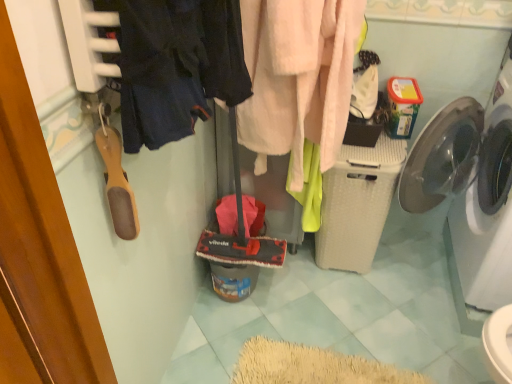
Describe the element at coordinates (357, 204) in the screenshot. The image size is (512, 384). I see `white textured laundry basket at center-right, which ranks as the second washing machine in right-to-left order` at that location.

Find the location of a particular element. Image resolution: width=512 pixels, height=384 pixels. wooden shoe at left is located at coordinates (117, 184).

Find the location of a particular element. This screenshot has height=384, width=512. white textured laundry basket at center-right, which ranks as the second washing machine in right-to-left order is located at coordinates (357, 204).

From a real-world perspective, which object rests below the other?

From a 3D spatial view, white textured laundry basket at center-right, which ranks as the second washing machine in right-to-left order, is below.

How far apart are wooden shoe at left and white textured laundry basket at center-right, which ranks as the second washing machine in right-to-left order?

The distance of wooden shoe at left from white textured laundry basket at center-right, which ranks as the second washing machine in right-to-left order, is 1.00 meters.

Is wooden shoe at left to the left of white textured laundry basket at center-right, which ranks as the second washing machine in right-to-left order, from the viewer's perspective?

Correct, you'll find wooden shoe at left to the left of white textured laundry basket at center-right, which ranks as the second washing machine in right-to-left order.

Which of these two, wooden shoe at left or white textured laundry basket at center-right, the first washing machine in the left-to-right sequence, is bigger?

white textured laundry basket at center-right, the first washing machine in the left-to-right sequence.

Based on the photo, in terms of width, does wooden shoe at left look wider or thinner when compared to white plastic washing machine at right, positioned as the 2th washing machine in left-to-right order?

wooden shoe at left is thinner than white plastic washing machine at right, positioned as the 2th washing machine in left-to-right order.

Does wooden shoe at left have a lesser height compared to white plastic washing machine at right, the first washing machine when ordered from right to left?

Yes.

From a real-world perspective, is wooden shoe at left physically located above or below white plastic washing machine at right, the first washing machine when ordered from right to left?

Clearly, from a real-world perspective, wooden shoe at left is above white plastic washing machine at right, the first washing machine when ordered from right to left.

Which object is positioned more to the left, wooden shoe at left or white plastic washing machine at right, the first washing machine when ordered from right to left?

Positioned to the left is wooden shoe at left.

How many degrees apart are the facing directions of white plastic washing machine at right, the first washing machine when ordered from right to left, and fuzzy pink towel at center, positioned as the first clothing in back-to-front order?

The angular difference between white plastic washing machine at right, the first washing machine when ordered from right to left, and fuzzy pink towel at center, positioned as the first clothing in back-to-front order, is 87.3 degrees.

Relative to fuzzy pink towel at center, placed as the second clothing when sorted from left to right, is white plastic washing machine at right, positioned as the 2th washing machine in left-to-right order, in front or behind?

In the image, white plastic washing machine at right, positioned as the 2th washing machine in left-to-right order, appears behind fuzzy pink towel at center, placed as the second clothing when sorted from left to right.

Is white plastic washing machine at right, the first washing machine when ordered from right to left, bigger or smaller than fuzzy pink towel at center, placed as the second clothing when sorted from left to right?

white plastic washing machine at right, the first washing machine when ordered from right to left, is bigger than fuzzy pink towel at center, placed as the second clothing when sorted from left to right.

The width and height of the screenshot is (512, 384). I want to click on washing machine that is the 1st object directly below the fuzzy pink towel at center, placed as the second clothing when sorted from left to right (from a real-world perspective), so (x=466, y=194).

Is wooden shoe at left turned away from fuzzy pink towel at center, positioned as the first clothing in back-to-front order?

wooden shoe at left is not turned away from fuzzy pink towel at center, positioned as the first clothing in back-to-front order.

Considering the sizes of objects wooden shoe at left and fuzzy pink towel at center, placed as the second clothing when sorted from left to right, in the image provided, who is taller, wooden shoe at left or fuzzy pink towel at center, placed as the second clothing when sorted from left to right,?

fuzzy pink towel at center, placed as the second clothing when sorted from left to right, is taller.

From the picture: Which object is more forward, wooden shoe at left or fuzzy pink towel at center, positioned as the first clothing in back-to-front order?

wooden shoe at left is more forward.

Where is `shoe that is above the fuzzy pink towel at center, placed as the second clothing when sorted from left to right (from a real-world perspective)`? Image resolution: width=512 pixels, height=384 pixels. shoe that is above the fuzzy pink towel at center, placed as the second clothing when sorted from left to right (from a real-world perspective) is located at coordinates (117, 184).

At what (x,y) coordinates should I click in order to perform the action: click on clothing in front of the fuzzy pink towel at center, positioned as the first clothing in back-to-front order. Please return your answer as a coordinate pair (x, y). The image size is (512, 384). Looking at the image, I should click on (177, 66).

How distant is fuzzy pink towel at center, placed as the first clothing when sorted from right to left, from dark blue fabric at upper left, positioned as the 2th clothing in right-to-left order?

fuzzy pink towel at center, placed as the first clothing when sorted from right to left, is 14.36 inches from dark blue fabric at upper left, positioned as the 2th clothing in right-to-left order.

Is fuzzy pink towel at center, the 2th clothing when ordered from front to back, next to dark blue fabric at upper left, which is counted as the 1th clothing, starting from the left?

No.

From their relative heights in the image, would you say fuzzy pink towel at center, placed as the first clothing when sorted from right to left, is taller or shorter than dark blue fabric at upper left, the first clothing viewed from the front?

In the image, fuzzy pink towel at center, placed as the first clothing when sorted from right to left, appears to be taller than dark blue fabric at upper left, the first clothing viewed from the front.

How distant is dark blue fabric at upper left, positioned as the 2th clothing in right-to-left order, from white textured laundry basket at center-right, the first washing machine in the left-to-right sequence?

dark blue fabric at upper left, positioned as the 2th clothing in right-to-left order, and white textured laundry basket at center-right, the first washing machine in the left-to-right sequence, are 32.54 inches apart.

In the image, is dark blue fabric at upper left, which is counted as the 1th clothing, starting from the left, positioned in front of or behind white textured laundry basket at center-right, the first washing machine in the left-to-right sequence?

dark blue fabric at upper left, which is counted as the 1th clothing, starting from the left, is in front of white textured laundry basket at center-right, the first washing machine in the left-to-right sequence.

Are dark blue fabric at upper left, the first clothing viewed from the front, and white textured laundry basket at center-right, which ranks as the second washing machine in right-to-left order, beside each other?

There is a gap between dark blue fabric at upper left, the first clothing viewed from the front, and white textured laundry basket at center-right, which ranks as the second washing machine in right-to-left order.

Is dark blue fabric at upper left, positioned as the 2th clothing in right-to-left order, surrounding white textured laundry basket at center-right, the first washing machine in the left-to-right sequence?

No, white textured laundry basket at center-right, the first washing machine in the left-to-right sequence, is not a part of dark blue fabric at upper left, positioned as the 2th clothing in right-to-left order.

Looking at this image, does white textured laundry basket at center-right, which ranks as the second washing machine in right-to-left order, have a lesser width compared to white plastic washing machine at right, the first washing machine when ordered from right to left?

Correct, the width of white textured laundry basket at center-right, which ranks as the second washing machine in right-to-left order, is less than that of white plastic washing machine at right, the first washing machine when ordered from right to left.

Locate an element on the screen. washing machine below the white plastic washing machine at right, the first washing machine when ordered from right to left (from a real-world perspective) is located at coordinates (357, 204).

Considering the positions of objects white textured laundry basket at center-right, which ranks as the second washing machine in right-to-left order, and white plastic washing machine at right, positioned as the 2th washing machine in left-to-right order, in the image provided, who is in front, white textured laundry basket at center-right, which ranks as the second washing machine in right-to-left order, or white plastic washing machine at right, positioned as the 2th washing machine in left-to-right order,?

white plastic washing machine at right, positioned as the 2th washing machine in left-to-right order, is in front.

From the image's perspective, does white textured laundry basket at center-right, the first washing machine in the left-to-right sequence, appear lower than white plastic washing machine at right, positioned as the 2th washing machine in left-to-right order?

Correct, white textured laundry basket at center-right, the first washing machine in the left-to-right sequence, appears lower than white plastic washing machine at right, positioned as the 2th washing machine in left-to-right order, in the image.

Where is `the 2nd washing machine below the wooden shoe at left (from a real-world perspective)`? Image resolution: width=512 pixels, height=384 pixels. the 2nd washing machine below the wooden shoe at left (from a real-world perspective) is located at coordinates (357, 204).

Locate an element on the screen. This screenshot has width=512, height=384. shoe lying on the left of white plastic washing machine at right, positioned as the 2th washing machine in left-to-right order is located at coordinates (117, 184).

Estimate the real-world distances between objects in this image. Which object is further from white textured laundry basket at center-right, which ranks as the second washing machine in right-to-left order, wooden shoe at left or white plastic washing machine at right, positioned as the 2th washing machine in left-to-right order?

Based on the image, wooden shoe at left appears to be further to white textured laundry basket at center-right, which ranks as the second washing machine in right-to-left order.

Estimate the real-world distances between objects in this image. Which object is further from white plastic washing machine at right, positioned as the 2th washing machine in left-to-right order, fuzzy pink towel at center, placed as the first clothing when sorted from right to left, or wooden shoe at left?

wooden shoe at left is positioned further to the anchor white plastic washing machine at right, positioned as the 2th washing machine in left-to-right order.

Looking at the image, which one is located closer to fuzzy pink towel at center, the 2th clothing when ordered from front to back, white textured laundry basket at center-right, which ranks as the second washing machine in right-to-left order, or dark blue fabric at upper left, the first clothing viewed from the front?

white textured laundry basket at center-right, which ranks as the second washing machine in right-to-left order, is positioned closer to the anchor fuzzy pink towel at center, the 2th clothing when ordered from front to back.

When comparing their distances from white textured laundry basket at center-right, which ranks as the second washing machine in right-to-left order, does dark blue fabric at upper left, the 2th clothing positioned from the back, or fuzzy pink towel at center, placed as the second clothing when sorted from left to right, seem further?

The object further to white textured laundry basket at center-right, which ranks as the second washing machine in right-to-left order, is dark blue fabric at upper left, the 2th clothing positioned from the back.

Looking at the image, which one is located closer to fuzzy pink towel at center, the 2th clothing when ordered from front to back, white textured laundry basket at center-right, the first washing machine in the left-to-right sequence, or white plastic washing machine at right, positioned as the 2th washing machine in left-to-right order?

white textured laundry basket at center-right, the first washing machine in the left-to-right sequence, lies closer to fuzzy pink towel at center, the 2th clothing when ordered from front to back, than the other object.

Based on their spatial positions, is white plastic washing machine at right, the first washing machine when ordered from right to left, or wooden shoe at left further from white textured laundry basket at center-right, the first washing machine in the left-to-right sequence?

wooden shoe at left is positioned further to the anchor white textured laundry basket at center-right, the first washing machine in the left-to-right sequence.

Consider the image. Estimate the real-world distances between objects in this image. Which object is further from dark blue fabric at upper left, the 2th clothing positioned from the back, white plastic washing machine at right, the first washing machine when ordered from right to left, or wooden shoe at left?

white plastic washing machine at right, the first washing machine when ordered from right to left, lies further to dark blue fabric at upper left, the 2th clothing positioned from the back, than the other object.

From the image, which object appears to be farther from fuzzy pink towel at center, positioned as the first clothing in back-to-front order, wooden shoe at left or white textured laundry basket at center-right, which ranks as the second washing machine in right-to-left order?

The object further to fuzzy pink towel at center, positioned as the first clothing in back-to-front order, is wooden shoe at left.

Locate an element on the screen. washing machine between wooden shoe at left and white plastic washing machine at right, positioned as the 2th washing machine in left-to-right order is located at coordinates (357, 204).

Identify the location of washing machine between dark blue fabric at upper left, the first clothing viewed from the front, and white plastic washing machine at right, the first washing machine when ordered from right to left. The height and width of the screenshot is (384, 512). (357, 204).

Locate an element on the screen. The height and width of the screenshot is (384, 512). clothing between dark blue fabric at upper left, the first clothing viewed from the front, and white plastic washing machine at right, the first washing machine when ordered from right to left is located at coordinates (297, 78).

Where is `clothing between dark blue fabric at upper left, which is counted as the 1th clothing, starting from the left, and white textured laundry basket at center-right, the first washing machine in the left-to-right sequence, in the front-back direction`? clothing between dark blue fabric at upper left, which is counted as the 1th clothing, starting from the left, and white textured laundry basket at center-right, the first washing machine in the left-to-right sequence, in the front-back direction is located at coordinates (297, 78).